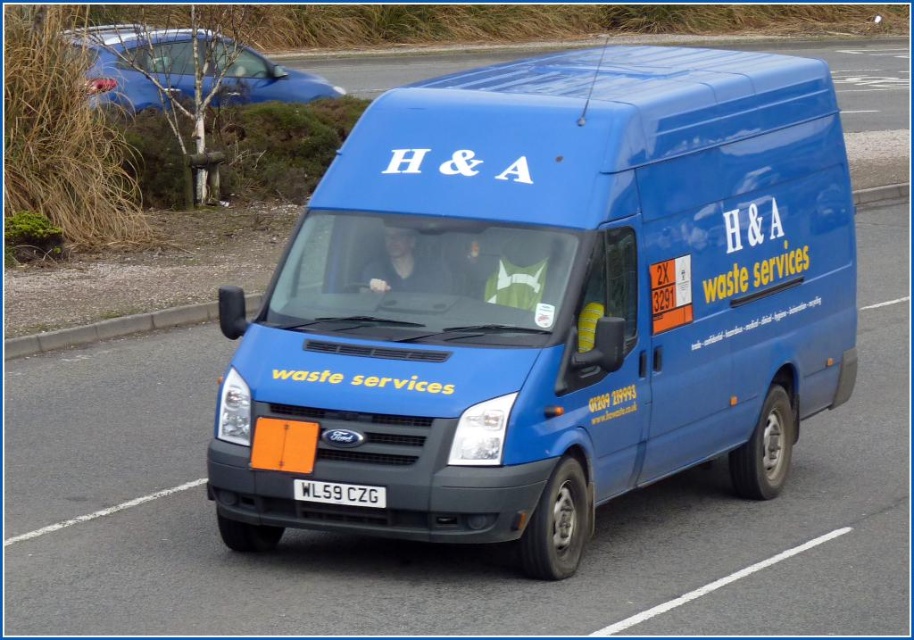
Question: Which object appears closest to the camera in this image?

Choices:
 (A) matte blue van at center
 (B) white plastic license plate at center

Answer: (B)

Question: Among these points, which one is nearest to the camera?

Choices:
 (A) (364, 499)
 (B) (543, 460)

Answer: (A)

Question: Does matte blue van at center appear over white plastic license plate at center?

Choices:
 (A) no
 (B) yes

Answer: (B)

Question: Can you confirm if matte blue van at center is positioned above white plastic license plate at center?

Choices:
 (A) no
 (B) yes

Answer: (B)

Question: Is matte blue van at center to the right of white plastic license plate at center from the viewer's perspective?

Choices:
 (A) yes
 (B) no

Answer: (A)